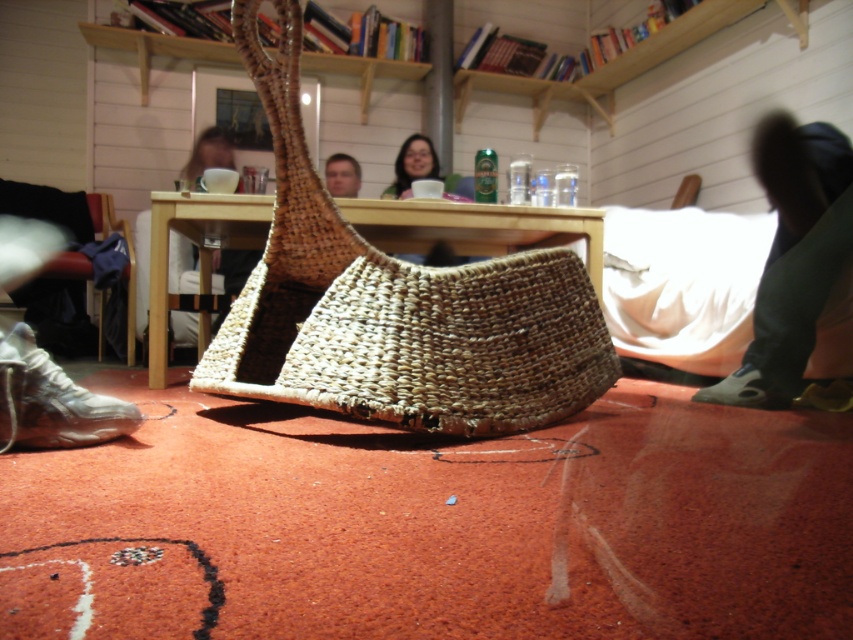
Which is in front, point (749, 369) or point (345, 168)?

Point (749, 369) is in front.

Find the location of a particular element. This screenshot has width=853, height=640. black leather shoe at lower right is located at coordinates (744, 392).

What are the coordinates of `white leather shoe at lower left` in the screenshot? It's located at (50, 397).

In the scene shown: Who is more forward, (79,436) or (352,182)?

Positioned in front is point (79,436).

Image resolution: width=853 pixels, height=640 pixels. I want to click on white leather shoe at lower left, so click(x=50, y=397).

Who is more forward, (299, 292) or (741, 388)?

Point (299, 292)

Does point (451, 342) come farther from viewer compared to point (785, 404)?

No, (451, 342) is closer to viewer.

Which is behind, point (563, 340) or point (740, 404)?

The point (740, 404) is more distant.

Where is `natural fiber basket at center`? The image size is (853, 640). natural fiber basket at center is located at coordinates (395, 305).